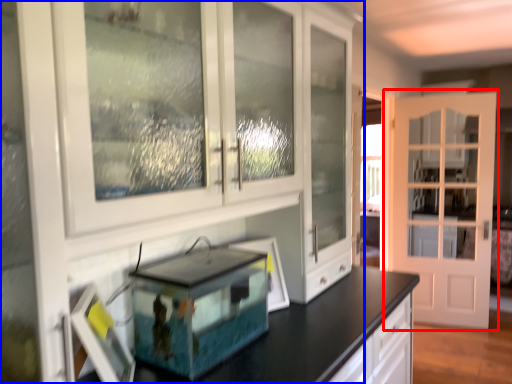
Question: Which point is further to the camera, door (highlighted by a red box) or cabinetry (highlighted by a blue box)?

Choices:
 (A) door
 (B) cabinetry

Answer: (A)